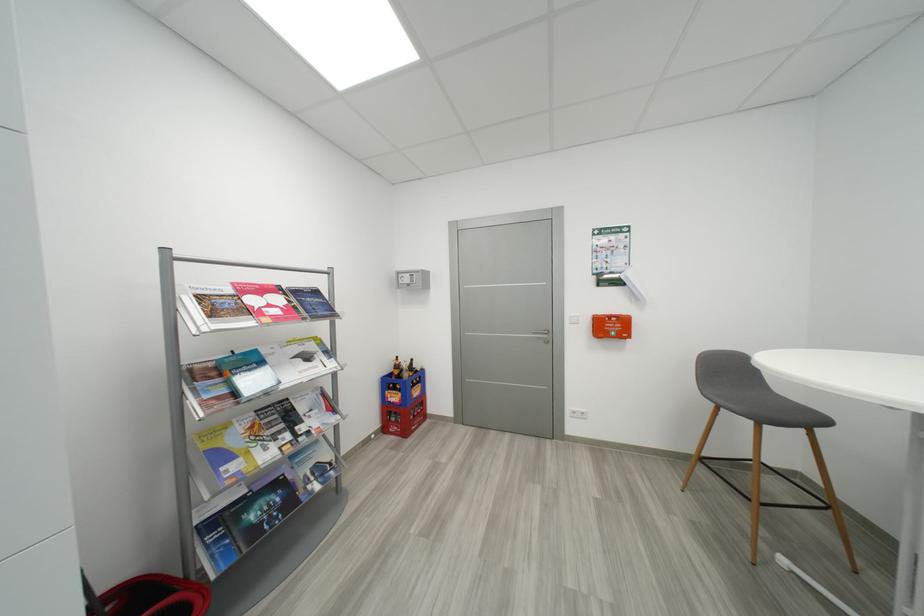
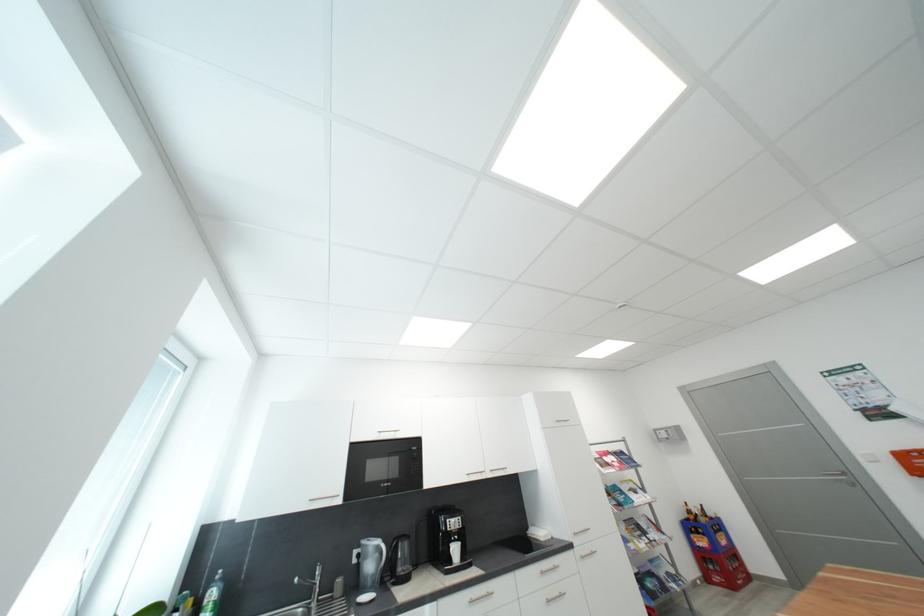
In the second image, find the point that corresponds to the point at 412,377 in the first image.

(710, 522)